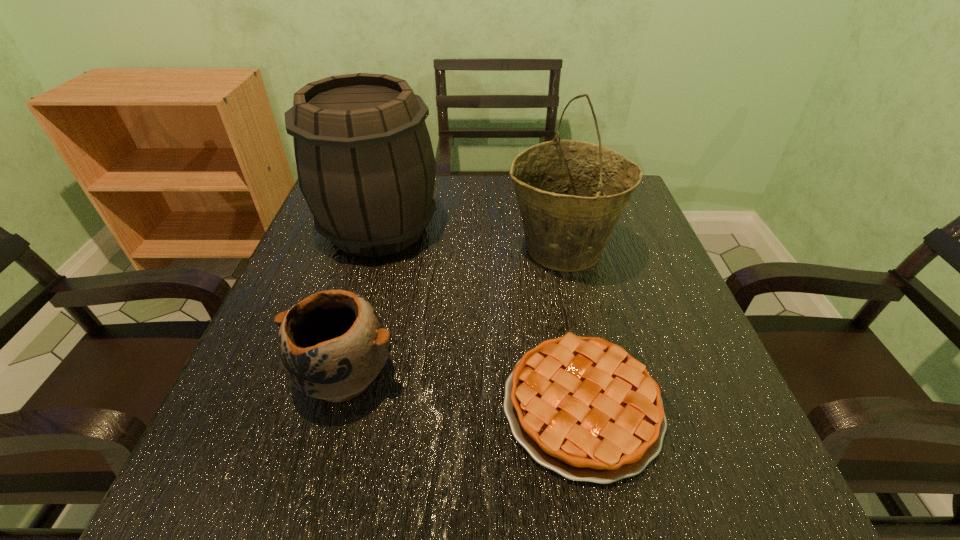
What are the coordinates of `the right wine bucket` in the screenshot? It's located at (571, 194).

The image size is (960, 540). Identify the location of the left wine bucket. (365, 163).

Locate an element on the screen. Image resolution: width=960 pixels, height=540 pixels. the third tallest object is located at coordinates (332, 344).

I want to click on pie, so click(x=583, y=407).

The height and width of the screenshot is (540, 960). I want to click on free space located on the right of the right wine bucket, so click(x=647, y=249).

I want to click on free region located 0.270m on the right of the left wine bucket, so click(552, 228).

Locate an element on the screen. free spot located on the right of the second shortest object is located at coordinates 442,375.

This screenshot has height=540, width=960. I want to click on free space located 0.110m on the left of the shortest object, so click(x=434, y=407).

Image resolution: width=960 pixels, height=540 pixels. Find the location of `object present at the near edge`. object present at the near edge is located at coordinates (583, 407).

Image resolution: width=960 pixels, height=540 pixels. In order to click on wine bucket that is at the left edge in this screenshot , I will do `click(365, 163)`.